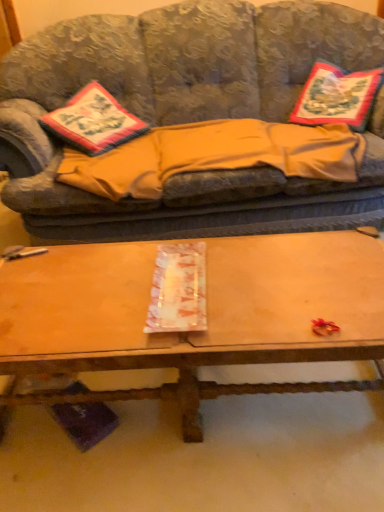
Where is `vacant area on top of wooden at center (from a real-world perspective)`? Image resolution: width=384 pixels, height=512 pixels. vacant area on top of wooden at center (from a real-world perspective) is located at coordinates (180, 285).